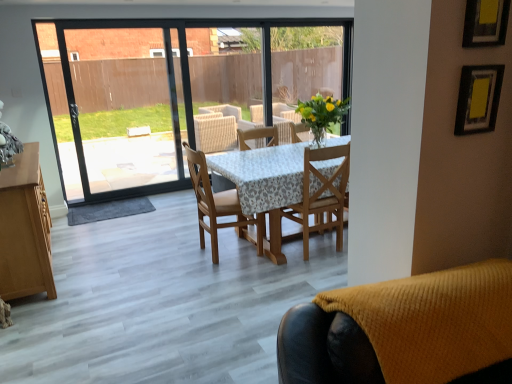
Identify the location of knitted yellow chair at lower right, the 3th chair from the back. This screenshot has height=384, width=512. (405, 331).

Image resolution: width=512 pixels, height=384 pixels. Find the location of `wooden chair at center, which ranks as the second chair in back-to-front order`. wooden chair at center, which ranks as the second chair in back-to-front order is located at coordinates (310, 205).

Locate an element on the screen. wooden chair at center, which ranks as the first chair in back-to-front order is located at coordinates (213, 202).

Is point (291, 311) farther from viewer compared to point (200, 213)?

That is False.

Choose the correct answer: Is knitted yellow chair at lower right, which is the first chair from front to back, inside wooden chair at center, the third chair positioned from the front, or outside it?

knitted yellow chair at lower right, which is the first chair from front to back, is spatially situated outside wooden chair at center, the third chair positioned from the front.

Does knitted yellow chair at lower right, which is the first chair from front to back, have a smaller size compared to wooden chair at center, which ranks as the first chair in back-to-front order?

Indeed, knitted yellow chair at lower right, which is the first chair from front to back, has a smaller size compared to wooden chair at center, which ranks as the first chair in back-to-front order.

Considering the relative sizes of knitted yellow chair at lower right, the 3th chair from the back, and wooden chair at center, which ranks as the first chair in back-to-front order, in the image provided, is knitted yellow chair at lower right, the 3th chair from the back, taller than wooden chair at center, which ranks as the first chair in back-to-front order,?

No, knitted yellow chair at lower right, the 3th chair from the back, is not taller than wooden chair at center, which ranks as the first chair in back-to-front order.

Measure the distance from wooden chair at center, the third chair positioned from the front, to knitted yellow chair at lower right, which is the first chair from front to back.

wooden chair at center, the third chair positioned from the front, is 2.19 meters away from knitted yellow chair at lower right, which is the first chair from front to back.

Is wooden chair at center, which ranks as the first chair in back-to-front order, aimed at knitted yellow chair at lower right, which is the first chair from front to back?

No.

From a real-world perspective, who is located higher, wooden chair at center, which ranks as the first chair in back-to-front order, or knitted yellow chair at lower right, which is the first chair from front to back?

knitted yellow chair at lower right, which is the first chair from front to back, from a real-world perspective.

Which is in front, wooden chair at center, which ranks as the first chair in back-to-front order, or knitted yellow chair at lower right, the 3th chair from the back?

knitted yellow chair at lower right, the 3th chair from the back.

Which object is positioned more to the right, wooden chair at center, the third chair positioned from the front, or wooden chair at center, which ranks as the second chair in back-to-front order?

From the viewer's perspective, wooden chair at center, which ranks as the second chair in back-to-front order, appears more on the right side.

From the picture: Which object is closer to the camera, wooden chair at center, which ranks as the first chair in back-to-front order, or wooden chair at center, which ranks as the second chair in back-to-front order?

wooden chair at center, which ranks as the second chair in back-to-front order, is in front.

Who is bigger, wooden chair at center, which ranks as the first chair in back-to-front order, or wooden chair at center, which is the 2th chair in front-to-back order?

Bigger between the two is wooden chair at center, which ranks as the first chair in back-to-front order.

Is knitted yellow chair at lower right, the 3th chair from the back, facing towards wooden chair at center, which is the 2th chair in front-to-back order?

No, knitted yellow chair at lower right, the 3th chair from the back, is not turned towards wooden chair at center, which is the 2th chair in front-to-back order.

Considering the sizes of knitted yellow chair at lower right, which is the first chair from front to back, and wooden chair at center, which is the 2th chair in front-to-back order, in the image, is knitted yellow chair at lower right, which is the first chair from front to back, bigger or smaller than wooden chair at center, which is the 2th chair in front-to-back order,?

knitted yellow chair at lower right, which is the first chair from front to back, is smaller than wooden chair at center, which is the 2th chair in front-to-back order.

Is knitted yellow chair at lower right, which is the first chair from front to back, at the right side of wooden chair at center, which is the 2th chair in front-to-back order?

No.

Identify the location of chair in front of the wooden chair at center, which is the 2th chair in front-to-back order. (405, 331).

From the image's perspective, is wooden chair at center, which is the 2th chair in front-to-back order, under knitted yellow chair at lower right, the 3th chair from the back?

No, from the image's perspective, wooden chair at center, which is the 2th chair in front-to-back order, is not beneath knitted yellow chair at lower right, the 3th chair from the back.

Are wooden chair at center, which ranks as the second chair in back-to-front order, and knitted yellow chair at lower right, which is the first chair from front to back, far apart?

Yes, wooden chair at center, which ranks as the second chair in back-to-front order, is far from knitted yellow chair at lower right, which is the first chair from front to back.

Which of these two, wooden chair at center, which ranks as the second chair in back-to-front order, or knitted yellow chair at lower right, the 3th chair from the back, is thinner?

Thinner between the two is knitted yellow chair at lower right, the 3th chair from the back.

Who is taller, wooden chair at center, which ranks as the second chair in back-to-front order, or knitted yellow chair at lower right, the 3th chair from the back?

Standing taller between the two is wooden chair at center, which ranks as the second chair in back-to-front order.

Would you say wooden chair at center, which ranks as the second chair in back-to-front order, is outside wooden chair at center, the third chair positioned from the front?

Yes.

Is wooden chair at center, which ranks as the second chair in back-to-front order, touching wooden chair at center, which ranks as the first chair in back-to-front order?

No, wooden chair at center, which ranks as the second chair in back-to-front order, is not beside wooden chair at center, which ranks as the first chair in back-to-front order.

The width and height of the screenshot is (512, 384). What are the coordinates of `the 1st chair to the right of the wooden chair at center, the third chair positioned from the front, counting from the anchor's position` in the screenshot? It's located at (405, 331).

From a real-world perspective, which chair is the 2nd one above the wooden chair at center, the third chair positioned from the front? Please provide its 2D coordinates.

[(405, 331)]

Based on their spatial positions, is wooden chair at center, which is the 2th chair in front-to-back order, or knitted yellow chair at lower right, the 3th chair from the back, further from wooden chair at center, which ranks as the first chair in back-to-front order?

The object further to wooden chair at center, which ranks as the first chair in back-to-front order, is knitted yellow chair at lower right, the 3th chair from the back.

In the scene shown: Considering their positions, is knitted yellow chair at lower right, the 3th chair from the back, positioned closer to wooden chair at center, which is the 2th chair in front-to-back order, than wooden chair at center, which ranks as the first chair in back-to-front order?

wooden chair at center, which ranks as the first chair in back-to-front order, lies closer to wooden chair at center, which is the 2th chair in front-to-back order, than the other object.

Estimate the real-world distances between objects in this image. Which object is closer to knitted yellow chair at lower right, which is the first chair from front to back, wooden chair at center, which ranks as the first chair in back-to-front order, or wooden chair at center, which is the 2th chair in front-to-back order?

wooden chair at center, which is the 2th chair in front-to-back order, is closer to knitted yellow chair at lower right, which is the first chair from front to back.

From the image, which object appears to be nearer to knitted yellow chair at lower right, which is the first chair from front to back, wooden chair at center, which is the 2th chair in front-to-back order, or wooden chair at center, which ranks as the first chair in back-to-front order?

The object closer to knitted yellow chair at lower right, which is the first chair from front to back, is wooden chair at center, which is the 2th chair in front-to-back order.

Considering their positions, is knitted yellow chair at lower right, which is the first chair from front to back, positioned further to wooden chair at center, which ranks as the first chair in back-to-front order, than wooden chair at center, which ranks as the second chair in back-to-front order?

knitted yellow chair at lower right, which is the first chair from front to back.

From the image, which object appears to be farther from wooden chair at center, which ranks as the second chair in back-to-front order, wooden chair at center, the third chair positioned from the front, or knitted yellow chair at lower right, the 3th chair from the back?

Among the two, knitted yellow chair at lower right, the 3th chair from the back, is located further to wooden chair at center, which ranks as the second chair in back-to-front order.

This screenshot has height=384, width=512. Find the location of `chair positioned between knitted yellow chair at lower right, which is the first chair from front to back, and wooden chair at center, which ranks as the first chair in back-to-front order, from near to far`. chair positioned between knitted yellow chair at lower right, which is the first chair from front to back, and wooden chair at center, which ranks as the first chair in back-to-front order, from near to far is located at coordinates (310, 205).